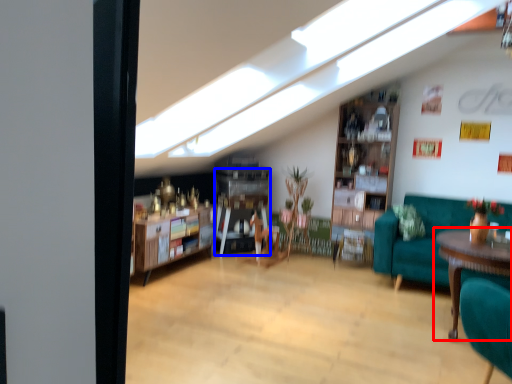
Question: Which object is closer to the camera taking this photo, table (highlighted by a red box) or shelf (highlighted by a blue box)?

Choices:
 (A) table
 (B) shelf

Answer: (A)